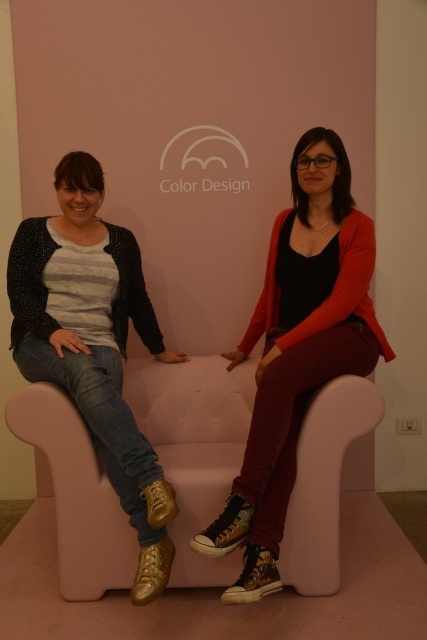
Is matte black cardigan at center thinner than denim jeans at left?

No, matte black cardigan at center is not thinner than denim jeans at left.

Does matte black cardigan at center have a lesser height compared to denim jeans at left?

In fact, matte black cardigan at center may be taller than denim jeans at left.

Is point (266, 346) in front of point (87, 364)?

No, (266, 346) is behind (87, 364).

Where is `matte black cardigan at center`? matte black cardigan at center is located at coordinates (298, 349).

Is point (234, 460) more distant than point (125, 323)?

No, it is not.

Between point (67, 531) and point (107, 252), which one is positioned behind?

The point (107, 252) is more distant.

Identify the location of pink foam couch at center. (195, 445).

Looking at this image, who is taller, pink foam couch at center or matte black cardigan at center?

Standing taller between the two is matte black cardigan at center.

Is the position of pink foam couch at center more distant than that of matte black cardigan at center?

Yes, pink foam couch at center is behind matte black cardigan at center.

Who is more forward, (123, 556) or (366, 296)?

Point (123, 556)

The width and height of the screenshot is (427, 640). What are the coordinates of `pink foam couch at center` in the screenshot? It's located at (195, 445).